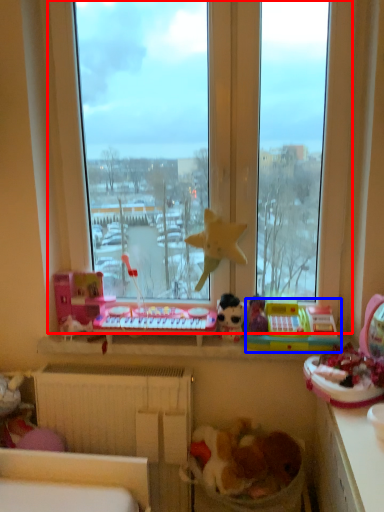
Question: Which point is further to the camera, window (highlighted by a red box) or toy (highlighted by a blue box)?

Choices:
 (A) window
 (B) toy

Answer: (B)